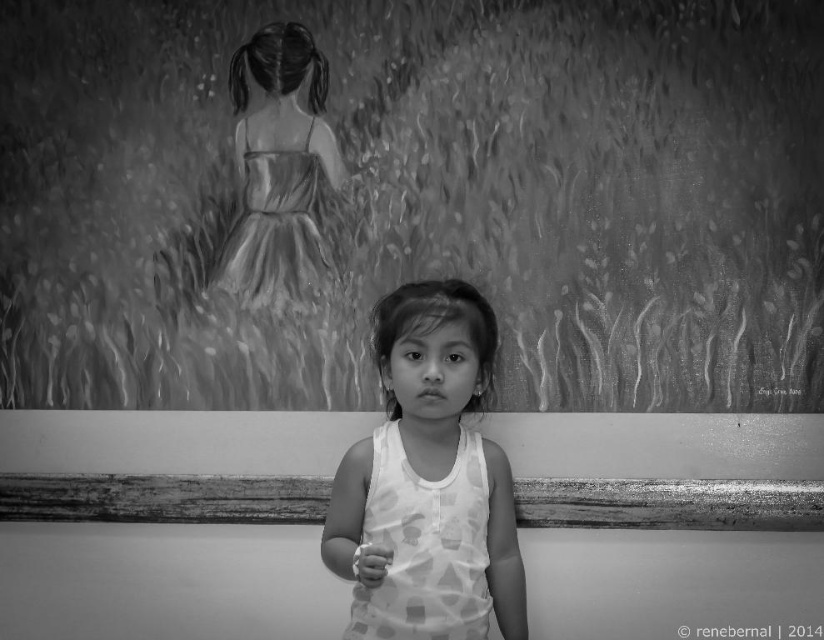
You are a photographer analyzing the composition of this black and white photo. The girl is wearing a white dotted tank top at center. To ensure the focus remains on her clothing, where should you adjust your camera focus point to? Please provide coordinates in the format of x,y between 0 and 1.

The white dotted tank top at center is located at point (433, 368). To focus on it, set the camera focus point to (433, 368).

You are a photographer analyzing the image. You notice two points in the scene at coordinates point (483, 445) and point (263, 182). Which point is closer to the viewer?

Point (483, 445) is closer to the viewer than point (263, 182).